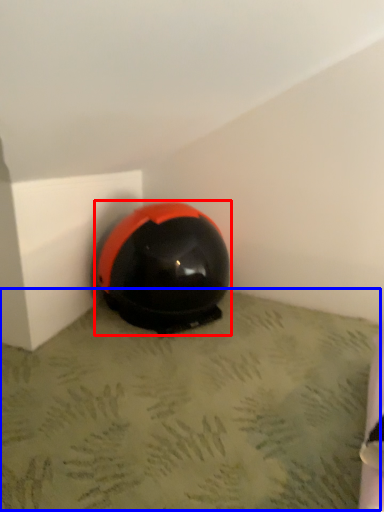
Question: Which of the following is the farthest to the observer, helmet (highlighted by a red box) or concrete (highlighted by a blue box)?

Choices:
 (A) helmet
 (B) concrete

Answer: (A)